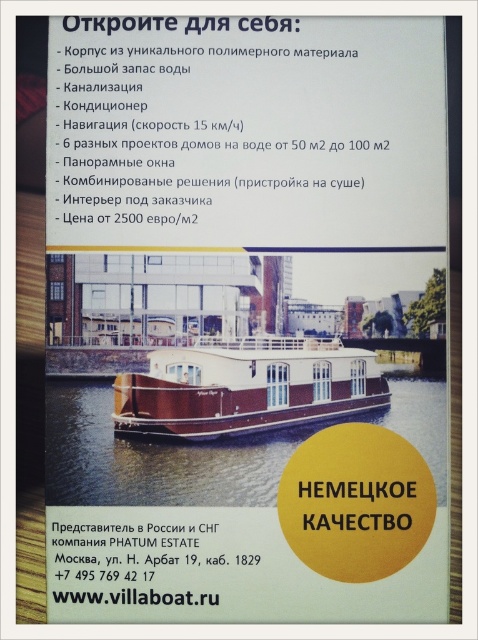
Question: Which point is closer to the camera taking this photo?

Choices:
 (A) (101, 472)
 (B) (204, 378)

Answer: (A)

Question: Is brown wooden boat at center bigger than brown polished wood boat at center?

Choices:
 (A) no
 (B) yes

Answer: (B)

Question: Which point is closer to the camera?

Choices:
 (A) brown polished wood boat at center
 (B) brown wooden boat at center

Answer: (B)

Question: Which point is farther to the camera?

Choices:
 (A) (317, 413)
 (B) (94, 476)

Answer: (A)

Question: Is the position of brown wooden boat at center less distant than that of brown polished wood boat at center?

Choices:
 (A) no
 (B) yes

Answer: (B)

Question: Can you confirm if brown wooden boat at center is wider than brown polished wood boat at center?

Choices:
 (A) yes
 (B) no

Answer: (B)